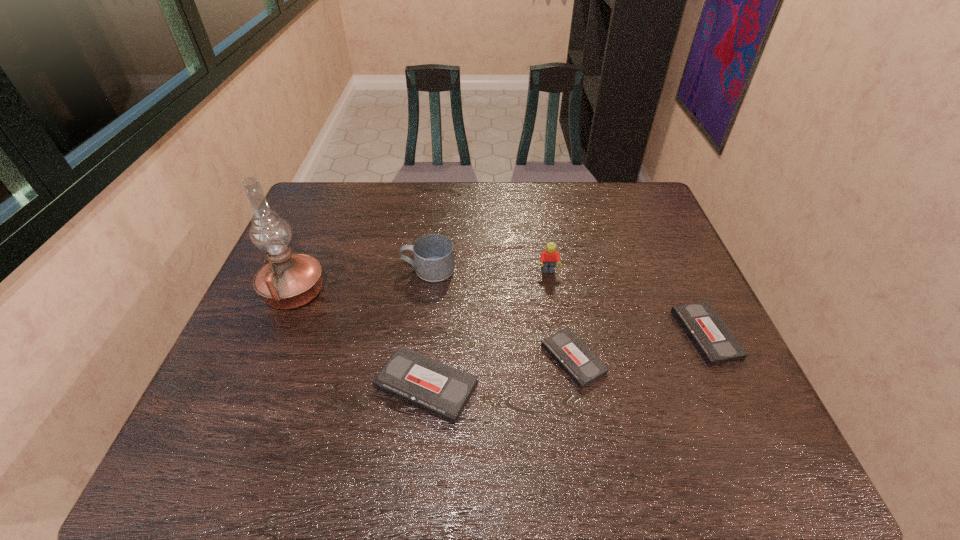
In order to click on free space that satisfies the following two spatial constraints: 1. on the face of the Lego; 2. on the right side of the rightmost object in this screenshot , I will do `click(559, 334)`.

You are a GUI agent. You are given a task and a screenshot of the screen. Output one action in this format:
    pyautogui.click(x=<x>, y=<y>)
    Task: Click on the free location that satisfies the following two spatial constraints: 1. on the back side of the fifth tallest object; 2. on the side of the mug with the handle
    Image resolution: width=960 pixels, height=540 pixels.
    Given the screenshot: What is the action you would take?
    pyautogui.click(x=676, y=269)

At what (x,y) coordinates should I click in order to perform the action: click on vacant position in the image that satisfies the following two spatial constraints: 1. on the side of the mug with the handle; 2. on the right side of the leftmost videotape. Please return your answer as a coordinate pair (x, y). The height and width of the screenshot is (540, 960). Looking at the image, I should click on (415, 386).

Locate an element on the screen. vacant space that satisfies the following two spatial constraints: 1. on the side of the shortest videotape with the handle; 2. on the right side of the mug is located at coordinates (418, 359).

The height and width of the screenshot is (540, 960). In order to click on free space that satisfies the following two spatial constraints: 1. on the face of the Lego; 2. on the right side of the second shortest videotape in this screenshot , I will do `click(559, 334)`.